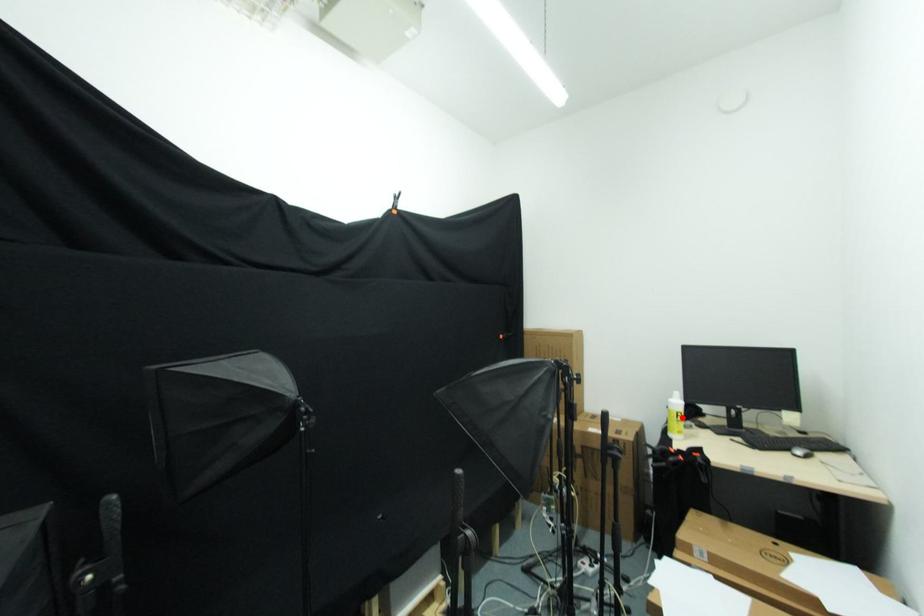
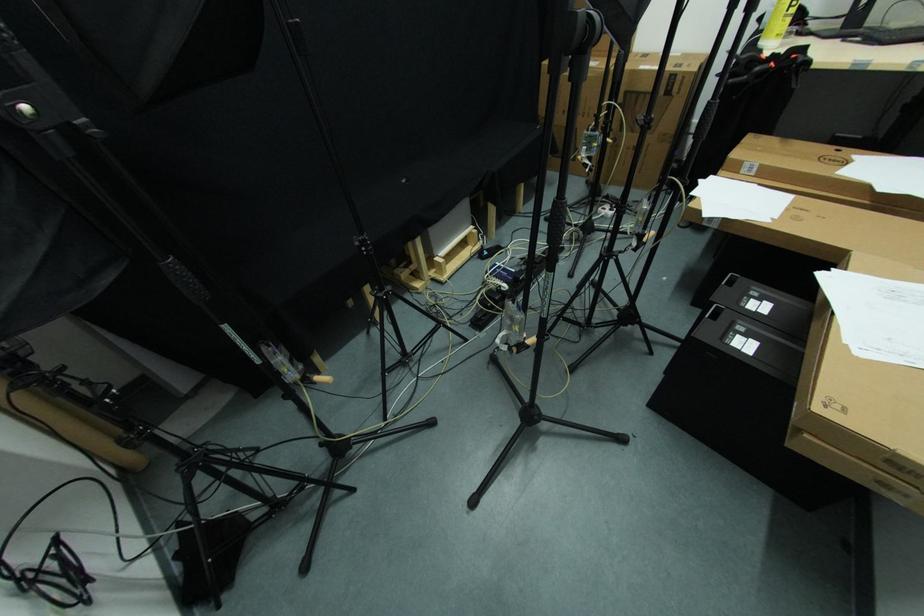
Question: I am providing you with two images of the same scene from different viewpoints. A red point is shown in image1. For the corresponding object point in image2, is it positioned nearer or farther from the camera?

Choices:
 (A) Nearer
 (B) Farther

Answer: (B)